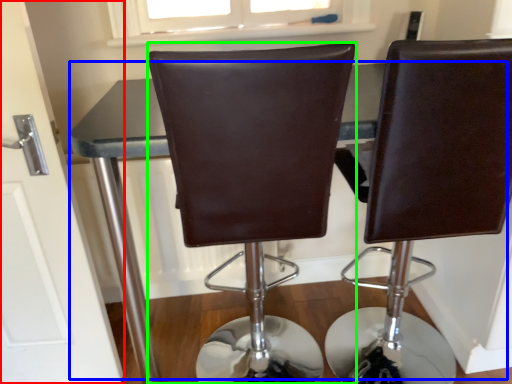
Question: Based on their relative distances, which object is nearer to door (highlighted by a red box)? Choose from table (highlighted by a blue box) and chair (highlighted by a green box).

Choices:
 (A) table
 (B) chair

Answer: (A)